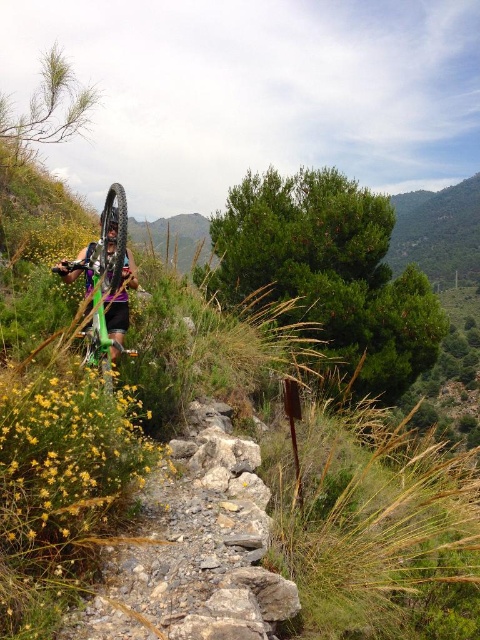
Question: Is rocky gravel trail at center positioned at the back of green matte bicycle at center?

Choices:
 (A) no
 (B) yes

Answer: (A)

Question: Which point appears closest to the camera in this image?

Choices:
 (A) (204, 412)
 (B) (109, 305)

Answer: (B)

Question: Can you confirm if rocky gravel trail at center is thinner than green matte bicycle at center?

Choices:
 (A) yes
 (B) no

Answer: (B)

Question: Among these objects, which one is farthest from the camera?

Choices:
 (A) green matte bicycle at center
 (B) rocky gravel trail at center

Answer: (A)

Question: Which of the following is the farthest from the observer?

Choices:
 (A) (196, 564)
 (B) (115, 337)

Answer: (B)

Question: Does rocky gravel trail at center have a smaller size compared to green matte bicycle at center?

Choices:
 (A) no
 (B) yes

Answer: (A)